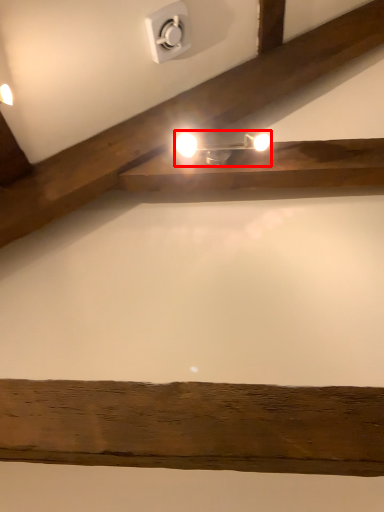
Question: From the image's perspective, what is the correct spatial positioning of lamp (annotated by the red box) in reference to electric outlet?

Choices:
 (A) below
 (B) above

Answer: (A)